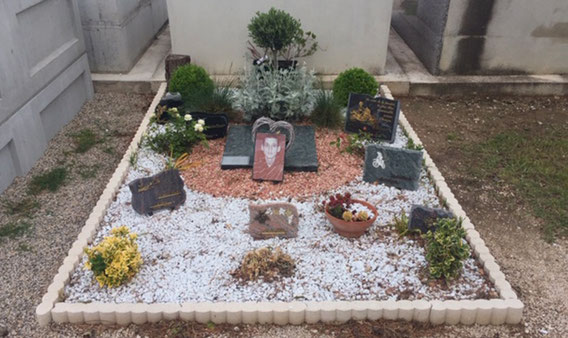
Locate an element on the screen. Image resolution: width=568 pixels, height=338 pixels. rightmost wall is located at coordinates pos(534,50).